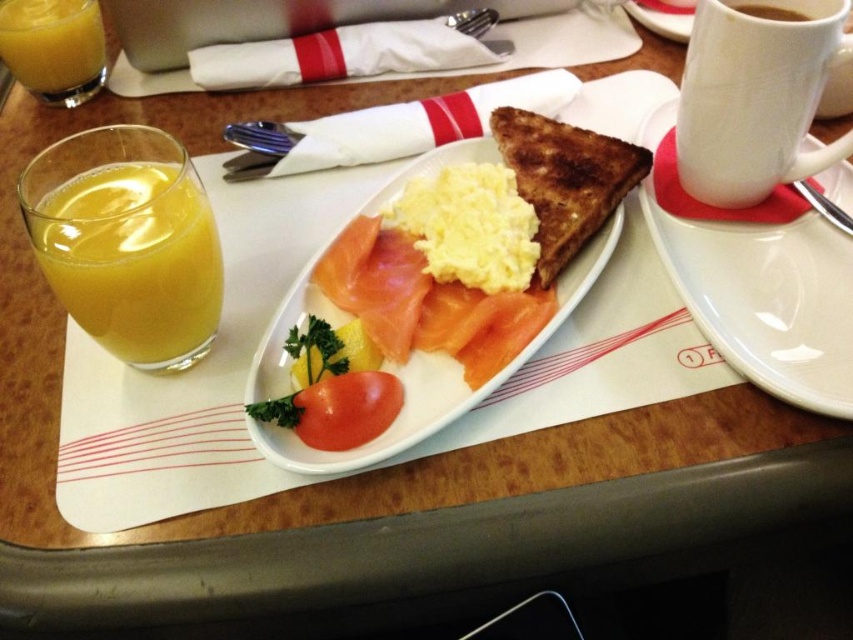
You are sitting in an airplane seat and want to reach a specific point on your tray table. You see two points marked on the tray table. The first point is at coordinate point (381, 403) and the second is at point (778, 20). Which point is closer to you?

Point (381, 403) is in front of point (778, 20), so it is closer to you.

You are a flight attendant and need to place a 15 inch long silverware set between the red matte tomato at center and the brown matte cup at upper right. Is there enough space for the silverware set between them?

The red matte tomato at center is 14.70 inches away from the brown matte cup at upper right. Since the silverware set is 15 inches long, it would not fit between them as the distance is slightly shorter than the required space.